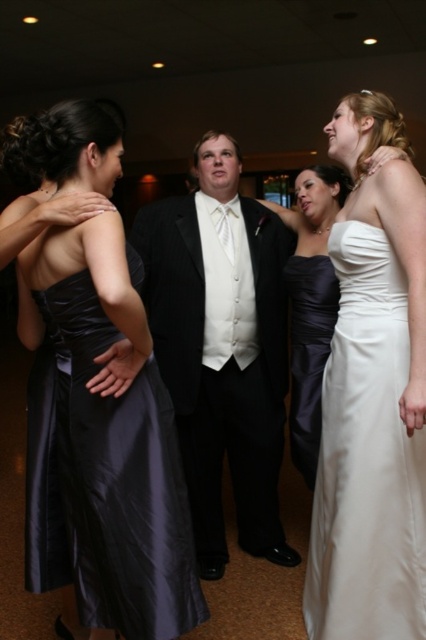
You are a photographer at this event. You need to position yourself so that both the black satin suit at center and the satin black dress at left are visible in your frame. Which object should you focus on first to ensure both are in the frame?

The black satin suit at center is bigger than the satin black dress at left, so you should focus on the black satin suit at center first to ensure both are in the frame.

In the scene shown: You are a photographer at a formal event. You need to arrange the two women wearing the satin black dress at left and the satin dress at center for a group photo. Which dress should you adjust to ensure proper visibility in the photo?

The satin black dress at left has a larger size compared to the satin dress at center. Therefore, you should adjust the position of the satin black dress at left to ensure it doesn not block the view of the smaller satin dress at center.

You are a photographer at a formal event and need to position two guests for a photo. The guests are wearing the satin black dress at left and the white satin dress at right. Based on their attire, which dress is shorter?

The satin black dress at left is shorter than the white satin dress at right.